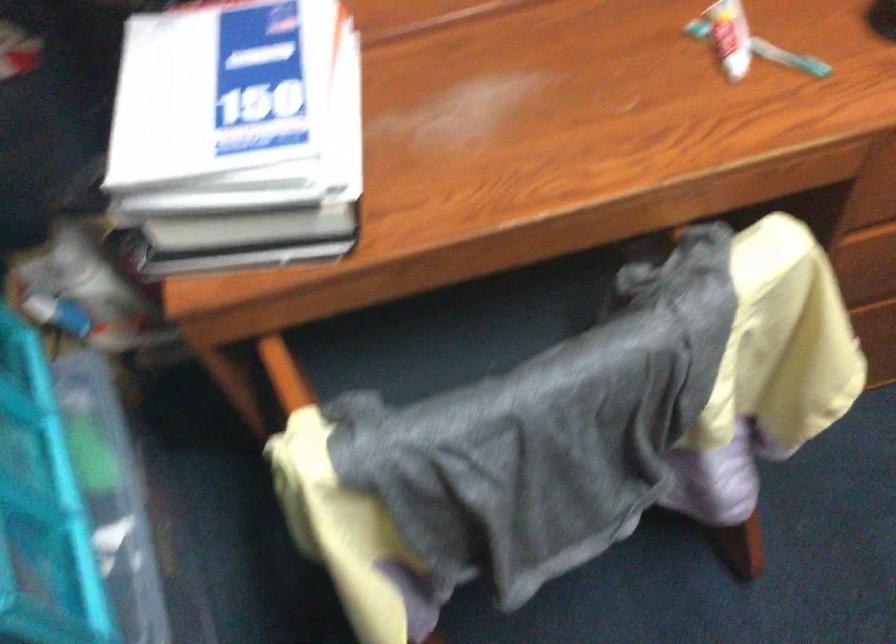
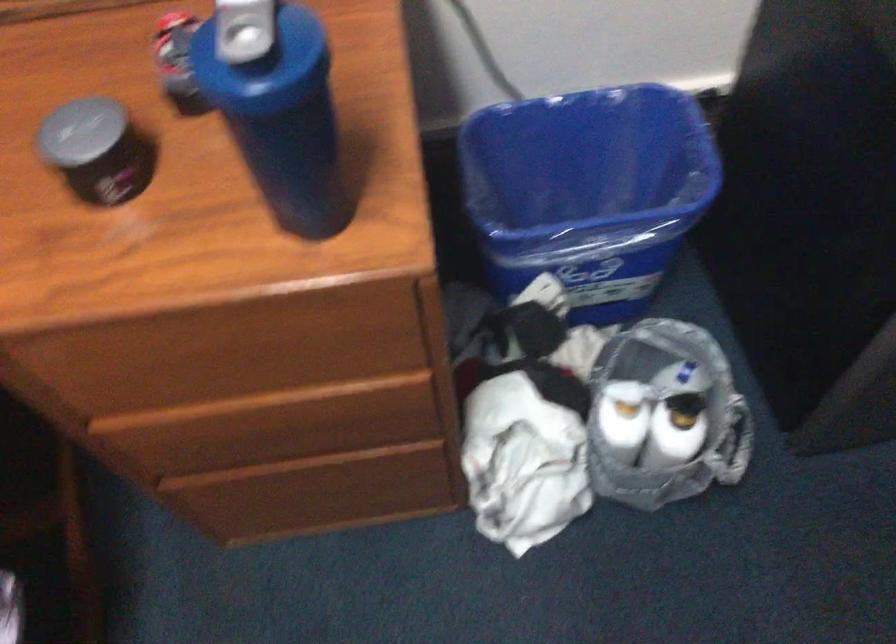
Question: The images are taken continuously from a first-person perspective. In which direction is your viewpoint rotating?

Choices:
 (A) Left
 (B) Right
 (C) Up
 (D) Down

Answer: (D)